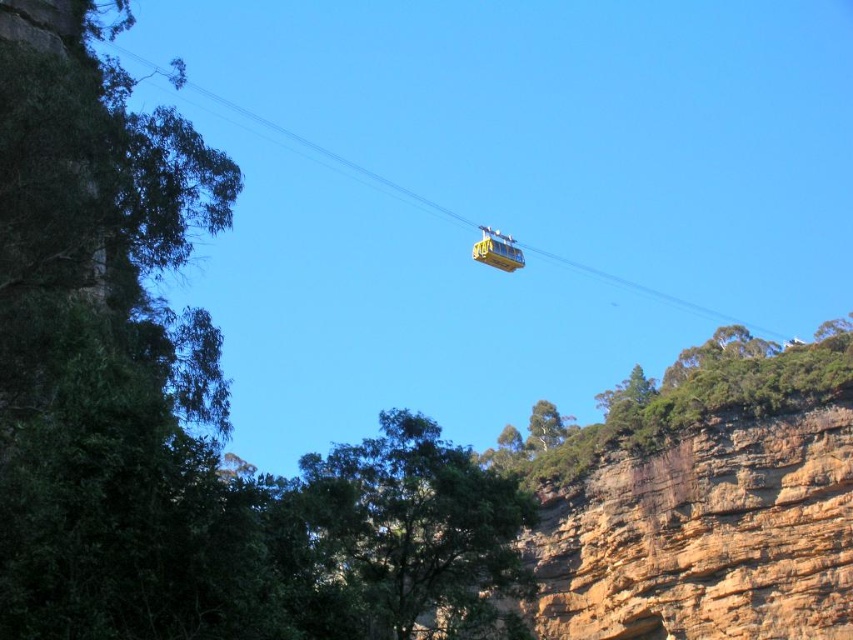
Question: Which point is farther from the camera taking this photo?

Choices:
 (A) (496, 264)
 (B) (308, 458)
 (C) (782, 352)
 (D) (664, 516)

Answer: (A)

Question: Which of the following is the farthest from the observer?

Choices:
 (A) (581, 625)
 (B) (512, 579)

Answer: (A)

Question: Is green rough rock at upper right to the left of yellow matte cable car at upper center from the viewer's perspective?

Choices:
 (A) no
 (B) yes

Answer: (A)

Question: Which object is farther from the camera taking this photo?

Choices:
 (A) green leafy tree at center
 (B) brown rocky cliff at lower right
 (C) yellow matte cable car at upper center
 (D) green rough rock at upper right

Answer: (C)

Question: Is brown rocky cliff at lower right positioned behind yellow matte cable car at upper center?

Choices:
 (A) yes
 (B) no

Answer: (B)

Question: Does green leafy tree at center appear over yellow matte cable car at upper center?

Choices:
 (A) no
 (B) yes

Answer: (A)